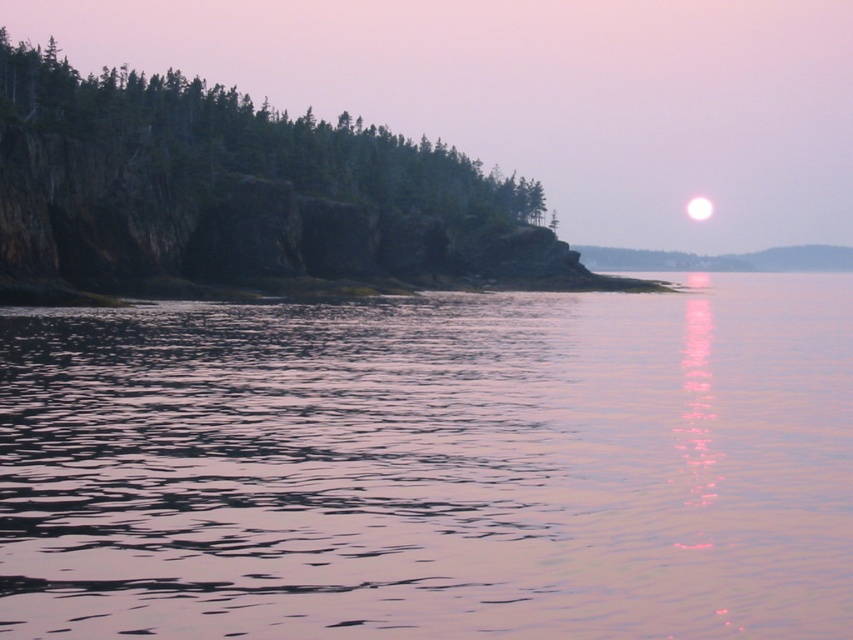
Question: Is smooth water at center to the right of green matte trees at upper left from the viewer's perspective?

Choices:
 (A) no
 (B) yes

Answer: (B)

Question: Can you confirm if smooth water at center is positioned above green matte trees at upper left?

Choices:
 (A) no
 (B) yes

Answer: (A)

Question: Which point is farther to the camera?

Choices:
 (A) (410, 209)
 (B) (0, 426)
 (C) (699, 198)

Answer: (C)

Question: Which point is farther to the camera?

Choices:
 (A) (699, 211)
 (B) (347, 436)
 (C) (120, 93)

Answer: (A)

Question: Which point is closer to the camera taking this photo?

Choices:
 (A) 482,188
 (B) 717,384

Answer: (B)

Question: Does green matte trees at upper left have a greater width compared to white glossy moon at upper right?

Choices:
 (A) no
 (B) yes

Answer: (B)